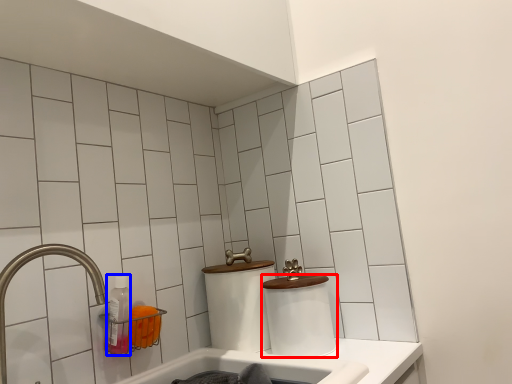
Question: Which object is further to the camera taking this photo, toilet paper (highlighted by a red box) or bottle (highlighted by a blue box)?

Choices:
 (A) toilet paper
 (B) bottle

Answer: (A)